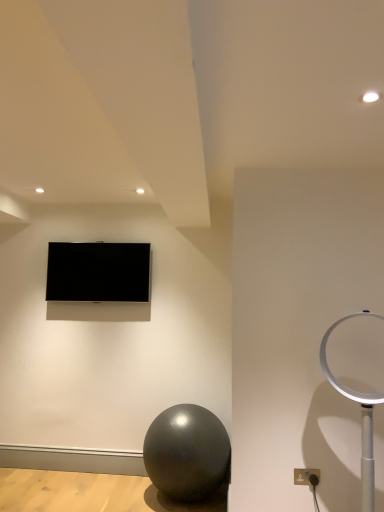
Describe the element at coordinates (362, 416) in the screenshot. This screenshot has width=384, height=512. I see `white plastic table lamp at right` at that location.

Locate an element on the screen. This screenshot has height=512, width=384. shiny metallic ball at lower center is located at coordinates (187, 452).

The width and height of the screenshot is (384, 512). What do you see at coordinates (98, 272) in the screenshot? I see `matte black tv at upper center` at bounding box center [98, 272].

I want to click on matte black tv at upper center, so click(98, 272).

The image size is (384, 512). Describe the element at coordinates (306, 477) in the screenshot. I see `matte gray outlet at lower right` at that location.

What are the coordinates of `matte gray outlet at lower right` in the screenshot? It's located at (306, 477).

The height and width of the screenshot is (512, 384). What are the coordinates of `white plastic table lamp at right` in the screenshot? It's located at [x=362, y=416].

Is matte black tv at upper center at the back of matte gray outlet at lower right?

No.

Based on the photo, which point is more forward, [316,483] or [104,258]?

Point [316,483]

Looking at this image, is matte gray outlet at lower right touching matte black tv at upper center?

No, matte gray outlet at lower right is not beside matte black tv at upper center.

Which object is wider, matte gray outlet at lower right or matte black tv at upper center?

With larger width is matte black tv at upper center.

Between white plastic table lamp at right and shiny metallic ball at lower center, which one has larger width?

shiny metallic ball at lower center.

Is white plastic table lamp at right beside shiny metallic ball at lower center?

white plastic table lamp at right and shiny metallic ball at lower center are clearly separated.

From the image's perspective, which one is positioned higher, white plastic table lamp at right or shiny metallic ball at lower center?

From the image's view, white plastic table lamp at right is above.

Is white plastic table lamp at right oriented towards shiny metallic ball at lower center?

No, white plastic table lamp at right does not turn towards shiny metallic ball at lower center.

Considering the relative positions of matte black tv at upper center and shiny metallic ball at lower center in the image provided, is matte black tv at upper center to the left of shiny metallic ball at lower center from the viewer's perspective?

Correct, you'll find matte black tv at upper center to the left of shiny metallic ball at lower center.

Looking at this image, is shiny metallic ball at lower center at the back of matte black tv at upper center?

No, shiny metallic ball at lower center is not at the back of matte black tv at upper center.

Considering their positions, is matte black tv at upper center located in front of or behind shiny metallic ball at lower center?

matte black tv at upper center is behind shiny metallic ball at lower center.

Considering the relative sizes of matte black tv at upper center and shiny metallic ball at lower center in the image provided, is matte black tv at upper center bigger than shiny metallic ball at lower center?

No.

Is matte black tv at upper center next to matte gray outlet at lower right?

No, matte black tv at upper center is not touching matte gray outlet at lower right.

Does matte black tv at upper center lie in front of matte gray outlet at lower right?

No, the depth of matte black tv at upper center is greater than that of matte gray outlet at lower right.

Considering the sizes of matte black tv at upper center and matte gray outlet at lower right in the image, is matte black tv at upper center taller or shorter than matte gray outlet at lower right?

matte black tv at upper center is taller than matte gray outlet at lower right.

How far apart are white plastic table lamp at right and matte black tv at upper center?

2.10 meters.

Considering the relative sizes of white plastic table lamp at right and matte black tv at upper center in the image provided, is white plastic table lamp at right taller than matte black tv at upper center?

Indeed, white plastic table lamp at right has a greater height compared to matte black tv at upper center.

Is white plastic table lamp at right in front of matte black tv at upper center?

Yes, it is.

Looking at this image, can you tell me how much white plastic table lamp at right and matte black tv at upper center differ in facing direction?

The angle between the facing direction of white plastic table lamp at right and the facing direction of matte black tv at upper center is 18.7 degrees.

From a real-world perspective, between white plastic table lamp at right and matte gray outlet at lower right, who is vertically lower?

matte gray outlet at lower right is physically lower.

Who is shorter, white plastic table lamp at right or matte gray outlet at lower right?

With less height is matte gray outlet at lower right.

Considering the positions of objects white plastic table lamp at right and matte gray outlet at lower right in the image provided, who is more to the right, white plastic table lamp at right or matte gray outlet at lower right?

white plastic table lamp at right is more to the right.

Is shiny metallic ball at lower center facing away from matte gray outlet at lower right?

No, shiny metallic ball at lower center's orientation is not away from matte gray outlet at lower right.

From the image's perspective, between shiny metallic ball at lower center and matte gray outlet at lower right, which one is located above?

matte gray outlet at lower right, from the image's perspective.

From a real-world perspective, does shiny metallic ball at lower center sit lower than matte gray outlet at lower right?

Yes, from a real-world perspective, shiny metallic ball at lower center is below matte gray outlet at lower right.

Is shiny metallic ball at lower center not inside matte gray outlet at lower right?

shiny metallic ball at lower center lies outside matte gray outlet at lower right's area.

Find the location of `electric outlet that is in front of the matte black tv at upper center`. electric outlet that is in front of the matte black tv at upper center is located at coordinates (306, 477).

This screenshot has width=384, height=512. In the image, there is a white plastic table lamp at right. What are the coordinates of `ball below it (from the image's perspective)` in the screenshot? It's located at click(187, 452).

Based on their spatial positions, is white plastic table lamp at right or shiny metallic ball at lower center further from matte gray outlet at lower right?

shiny metallic ball at lower center lies further to matte gray outlet at lower right than the other object.

From the image, which object appears to be farther from matte black tv at upper center, white plastic table lamp at right or shiny metallic ball at lower center?

The object further to matte black tv at upper center is white plastic table lamp at right.

Estimate the real-world distances between objects in this image. Which object is closer to shiny metallic ball at lower center, matte gray outlet at lower right or matte black tv at upper center?

matte gray outlet at lower right.

Consider the image. From the image, which object appears to be nearer to matte gray outlet at lower right, matte black tv at upper center or white plastic table lamp at right?

The object closer to matte gray outlet at lower right is white plastic table lamp at right.

Looking at the image, which one is located further to white plastic table lamp at right, shiny metallic ball at lower center or matte black tv at upper center?

Among the two, matte black tv at upper center is located further to white plastic table lamp at right.

Considering their positions, is matte gray outlet at lower right positioned further to shiny metallic ball at lower center than white plastic table lamp at right?

The object further to shiny metallic ball at lower center is white plastic table lamp at right.

Which object lies further to the anchor point matte black tv at upper center, shiny metallic ball at lower center or matte gray outlet at lower right?

The object further to matte black tv at upper center is matte gray outlet at lower right.

In the scene shown: Looking at the image, which one is located further to shiny metallic ball at lower center, matte black tv at upper center or matte gray outlet at lower right?

matte black tv at upper center is further to shiny metallic ball at lower center.

Locate an element on the screen. ball located between matte black tv at upper center and matte gray outlet at lower right in the left-right direction is located at coordinates (187, 452).

Locate an element on the screen. Image resolution: width=384 pixels, height=512 pixels. electric outlet between matte black tv at upper center and white plastic table lamp at right from left to right is located at coordinates (306, 477).

This screenshot has width=384, height=512. I want to click on ball positioned between white plastic table lamp at right and matte black tv at upper center from near to far, so pyautogui.click(x=187, y=452).

In order to click on electric outlet between shiny metallic ball at lower center and white plastic table lamp at right in the horizontal direction in this screenshot , I will do pos(306,477).